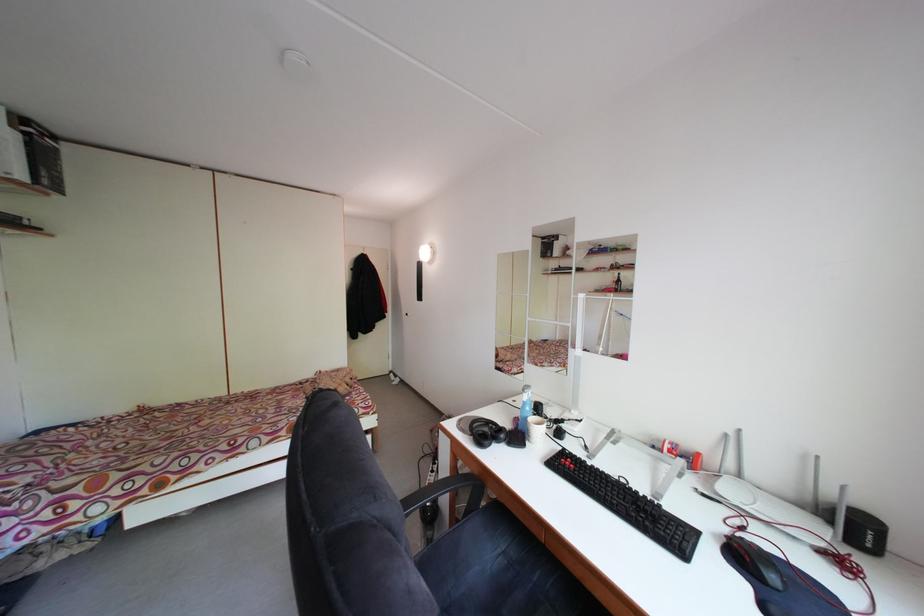
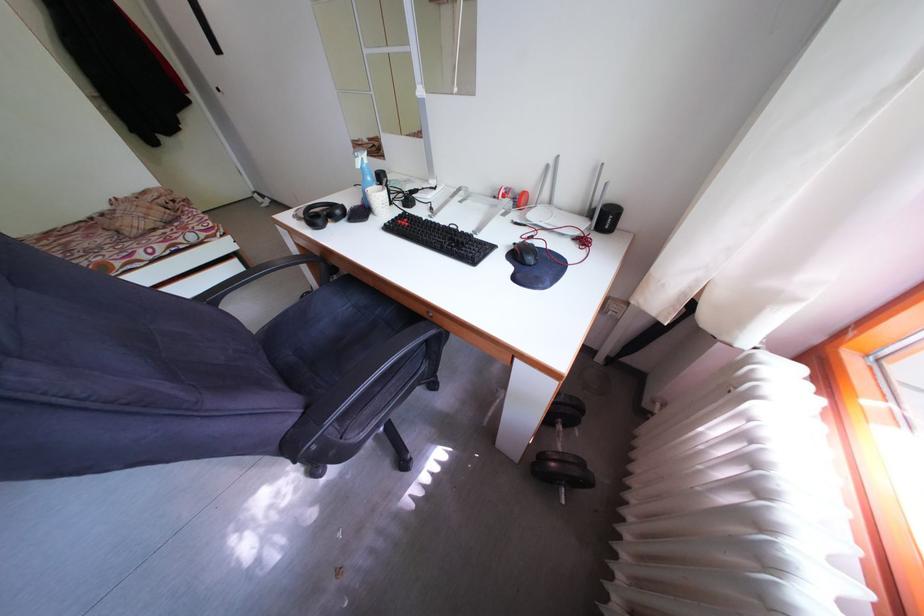
Locate, in the second image, the point that corresponds to point 488,440 in the first image.

(321, 223)